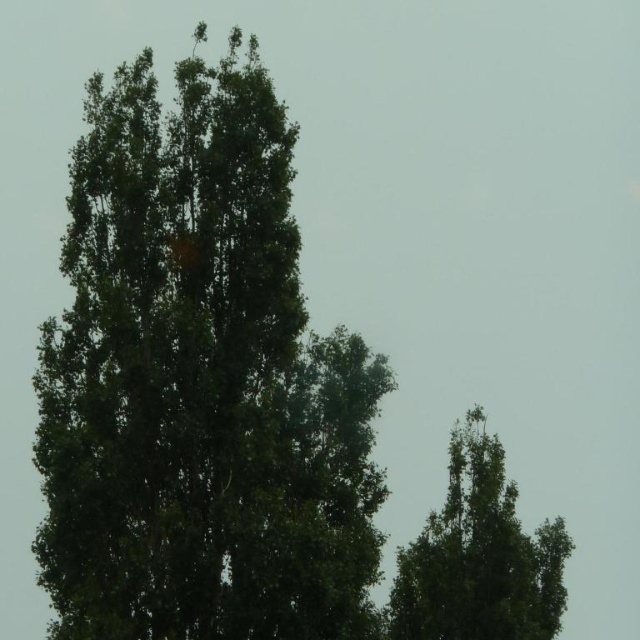
You are standing at the point labeled point (x=198, y=384) in the image. Which tree are you facing? The point is located at the center of the image. The tree at center is the shorter one with a rounded shape located at the bottom right. The other tree is taller and on the left. The point is exactly at the center of the image. So the tree at center is the shorter one at bottom right. Therefore, you are facing the green leafy tree at center which is the shorter one at bottom right. The answer is the green leafy

The point labeled point (x=198, y=384) is at the center of the image, so you are facing the green leafy tree at center, which is the shorter tree located at the bottom right of the frame with a rounded shape and dense canopy of dark green leaves.

You are a bird looking for a nesting spot. You see the green leafy tree at center and the green leafy tree at upper right. Which tree should you choose if you prefer a larger tree for nesting?

The green leafy tree at center is larger in size than the green leafy tree at upper right, so you should choose the green leafy tree at center for nesting.